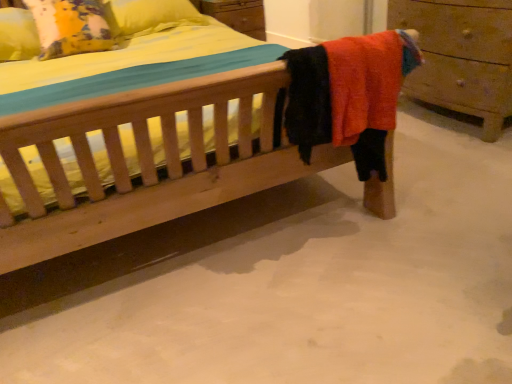
Question: Does white smooth concrete at lower center touch yellow fabric pillow at upper left?

Choices:
 (A) yes
 (B) no

Answer: (B)

Question: From a real-world perspective, is white smooth concrete at lower center on top of yellow fabric pillow at upper left?

Choices:
 (A) no
 (B) yes

Answer: (A)

Question: Is white smooth concrete at lower center surrounding yellow fabric pillow at upper left?

Choices:
 (A) yes
 (B) no

Answer: (B)

Question: Is white smooth concrete at lower center to the right of yellow fabric pillow at upper left from the viewer's perspective?

Choices:
 (A) no
 (B) yes

Answer: (B)

Question: Considering the relative sizes of white smooth concrete at lower center and yellow fabric pillow at upper left in the image provided, is white smooth concrete at lower center smaller than yellow fabric pillow at upper left?

Choices:
 (A) no
 (B) yes

Answer: (A)

Question: Considering the positions of point (174, 319) and point (72, 18), is point (174, 319) closer or farther from the camera than point (72, 18)?

Choices:
 (A) farther
 (B) closer

Answer: (B)

Question: From the image's perspective, relative to yellow fabric pillow at upper left, is white smooth concrete at lower center above or below?

Choices:
 (A) above
 (B) below

Answer: (B)

Question: From a real-world perspective, is white smooth concrete at lower center above or below yellow fabric pillow at upper left?

Choices:
 (A) below
 (B) above

Answer: (A)

Question: Looking at their shapes, would you say white smooth concrete at lower center is wider or thinner than yellow fabric pillow at upper left?

Choices:
 (A) wide
 (B) thin

Answer: (A)

Question: Is wooden chest of drawers at right wider or thinner than yellow fabric pillow at upper left?

Choices:
 (A) thin
 (B) wide

Answer: (A)

Question: Considering the positions of wooden chest of drawers at right and yellow fabric pillow at upper left in the image, is wooden chest of drawers at right taller or shorter than yellow fabric pillow at upper left?

Choices:
 (A) tall
 (B) short

Answer: (A)

Question: In the image, is wooden chest of drawers at right positioned in front of or behind yellow fabric pillow at upper left?

Choices:
 (A) front
 (B) behind

Answer: (A)

Question: Is wooden chest of drawers at right bigger or smaller than yellow fabric pillow at upper left?

Choices:
 (A) big
 (B) small

Answer: (A)

Question: Looking at their shapes, would you say yellow fabric pillow at upper left is wider or thinner than wooden chest of drawers at right?

Choices:
 (A) thin
 (B) wide

Answer: (B)

Question: Considering the relative positions of yellow fabric pillow at upper left and wooden chest of drawers at right in the image provided, is yellow fabric pillow at upper left to the left or to the right of wooden chest of drawers at right?

Choices:
 (A) right
 (B) left

Answer: (B)